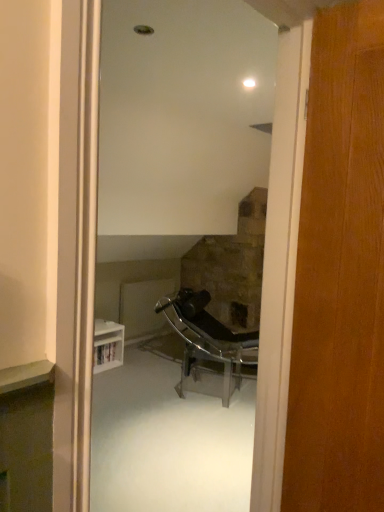
This screenshot has height=512, width=384. What do you see at coordinates (340, 274) in the screenshot?
I see `wooden door at right` at bounding box center [340, 274].

Where is `wooden door at right`? The width and height of the screenshot is (384, 512). wooden door at right is located at coordinates (340, 274).

This screenshot has width=384, height=512. Describe the element at coordinates (208, 339) in the screenshot. I see `metallic chrome chair at center` at that location.

The image size is (384, 512). Identify the location of metallic chrome chair at center. (208, 339).

Where is `wooden door at right`? The image size is (384, 512). wooden door at right is located at coordinates (340, 274).

Looking at this image, between wooden door at right and metallic chrome chair at center, which one appears on the left side from the viewer's perspective?

From the viewer's perspective, metallic chrome chair at center appears more on the left side.

Is wooden door at right positioned before metallic chrome chair at center?

Yes, it is in front of metallic chrome chair at center.

Is point (300, 253) positioned in front of point (177, 302)?

Yes, it is in front of point (177, 302).

From the image's perspective, which one is positioned higher, wooden door at right or metallic chrome chair at center?

wooden door at right, from the image's perspective.

From a real-world perspective, relative to metallic chrome chair at center, is wooden door at right vertically above or below?

From a real-world perspective, wooden door at right is physically above metallic chrome chair at center.

Considering the relative sizes of wooden door at right and metallic chrome chair at center in the image provided, is wooden door at right wider than metallic chrome chair at center?

No, wooden door at right is not wider than metallic chrome chair at center.

Who is shorter, wooden door at right or metallic chrome chair at center?

metallic chrome chair at center is shorter.

Considering the sizes of objects wooden door at right and metallic chrome chair at center in the image provided, who is bigger, wooden door at right or metallic chrome chair at center?

With larger size is metallic chrome chair at center.

Is wooden door at right spatially inside metallic chrome chair at center, or outside of it?

wooden door at right exists outside the volume of metallic chrome chair at center.

Is wooden door at right far away from metallic chrome chair at center?

Absolutely, wooden door at right is distant from metallic chrome chair at center.

Is metallic chrome chair at center at the back of wooden door at right?

No.

Locate an element on the screen. This screenshot has height=512, width=384. chair beneath the wooden door at right (from a real-world perspective) is located at coordinates (208, 339).

Which object is positioned more to the left, metallic chrome chair at center or wooden door at right?

metallic chrome chair at center is more to the left.

Is the position of metallic chrome chair at center more distant than that of wooden door at right?

Yes, the depth of metallic chrome chair at center is greater than that of wooden door at right.

Does point (221, 339) come in front of point (360, 243)?

No.

From the image's perspective, between metallic chrome chair at center and wooden door at right, which one is located above?

wooden door at right is shown above in the image.

From a real-world perspective, is metallic chrome chair at center physically located above or below wooden door at right?

metallic chrome chair at center is situated lower than wooden door at right in the real world.

Can you confirm if metallic chrome chair at center is wider than wooden door at right?

Yes.

Who is shorter, metallic chrome chair at center or wooden door at right?

With less height is metallic chrome chair at center.

Who is smaller, metallic chrome chair at center or wooden door at right?

wooden door at right.

Is wooden door at right inside metallic chrome chair at center?

No, wooden door at right is not surrounded by metallic chrome chair at center.

Is metallic chrome chair at center beside wooden door at right?

No, metallic chrome chair at center is not with wooden door at right.

Is metallic chrome chair at center facing towards wooden door at right?

No, metallic chrome chair at center is not facing towards wooden door at right.

Where is `chair directly beneath the wooden door at right (from a real-world perspective)`? Image resolution: width=384 pixels, height=512 pixels. chair directly beneath the wooden door at right (from a real-world perspective) is located at coordinates pos(208,339).

In the image, there is a wooden door at right. Where is `chair below it (from the image's perspective)`? chair below it (from the image's perspective) is located at coordinates (208, 339).

At what (x,y) coordinates should I click in order to perform the action: click on chair behind the wooden door at right. Please return your answer as a coordinate pair (x, y). The width and height of the screenshot is (384, 512). Looking at the image, I should click on (208, 339).